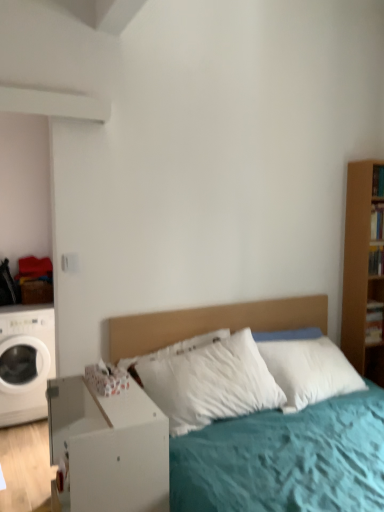
Question: Would you say white matte washing machine at left is outside white soft bed at center?

Choices:
 (A) yes
 (B) no

Answer: (A)

Question: Can you confirm if white matte washing machine at left is taller than white soft bed at center?

Choices:
 (A) no
 (B) yes

Answer: (B)

Question: Is white matte washing machine at left aimed at white soft bed at center?

Choices:
 (A) no
 (B) yes

Answer: (A)

Question: Is white matte washing machine at left thinner than white soft bed at center?

Choices:
 (A) yes
 (B) no

Answer: (B)

Question: Is white matte washing machine at left positioned before white soft bed at center?

Choices:
 (A) no
 (B) yes

Answer: (A)

Question: Based on their positions, is white soft bed at center located to the left or right of white matte washing machine at left?

Choices:
 (A) left
 (B) right

Answer: (B)

Question: Considering their positions, is white soft bed at center located in front of or behind white matte washing machine at left?

Choices:
 (A) behind
 (B) front

Answer: (B)

Question: Considering the positions of white soft bed at center and white matte washing machine at left in the image, is white soft bed at center bigger or smaller than white matte washing machine at left?

Choices:
 (A) big
 (B) small

Answer: (A)

Question: From their relative heights in the image, would you say white soft bed at center is taller or shorter than white matte washing machine at left?

Choices:
 (A) tall
 (B) short

Answer: (B)

Question: From a real-world perspective, relative to white matte nightstand at lower left, is white matte washing machine at left vertically above or below?

Choices:
 (A) above
 (B) below

Answer: (A)

Question: From the image's perspective, is white matte washing machine at left located above or below white matte nightstand at lower left?

Choices:
 (A) below
 (B) above

Answer: (B)

Question: From their relative heights in the image, would you say white matte washing machine at left is taller or shorter than white matte nightstand at lower left?

Choices:
 (A) tall
 (B) short

Answer: (A)

Question: Considering the positions of white matte washing machine at left and white matte nightstand at lower left in the image, is white matte washing machine at left wider or thinner than white matte nightstand at lower left?

Choices:
 (A) thin
 (B) wide

Answer: (B)

Question: Is point (8, 379) positioned closer to the camera than point (273, 448)?

Choices:
 (A) farther
 (B) closer

Answer: (A)

Question: From the image's perspective, relative to white soft bed at center, is white matte washing machine at left above or below?

Choices:
 (A) above
 (B) below

Answer: (B)